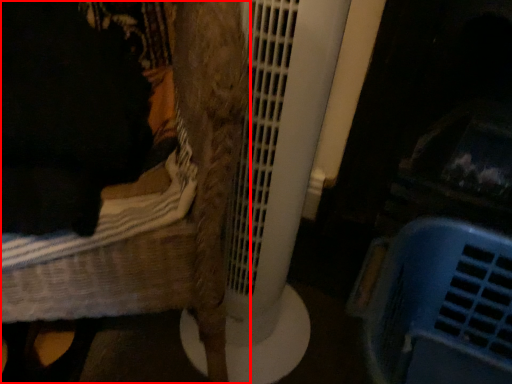
Question: From the image's perspective, what is the correct spatial relationship of furniture (annotated by the red box) in relation to basket?

Choices:
 (A) above
 (B) below

Answer: (A)